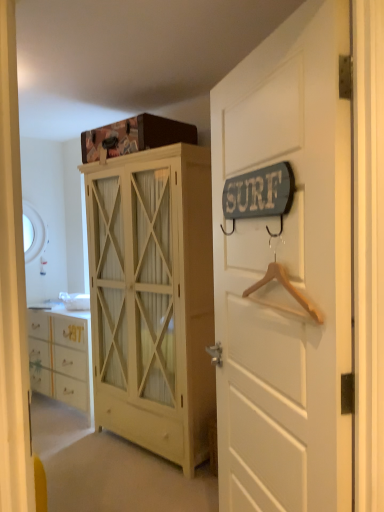
Question: Considering the relative sizes of wooden hanger at right and white wood door at upper right in the image provided, is wooden hanger at right taller than white wood door at upper right?

Choices:
 (A) yes
 (B) no

Answer: (B)

Question: Does wooden hanger at right have a lesser width compared to white wood door at upper right?

Choices:
 (A) yes
 (B) no

Answer: (A)

Question: From a real-world perspective, is wooden hanger at right beneath white wood door at upper right?

Choices:
 (A) no
 (B) yes

Answer: (A)

Question: Are wooden hanger at right and white wood door at upper right located far from each other?

Choices:
 (A) yes
 (B) no

Answer: (B)

Question: Is wooden hanger at right aimed at white wood door at upper right?

Choices:
 (A) yes
 (B) no

Answer: (A)

Question: Is wooden hanger at right at the left side of white wood door at upper right?

Choices:
 (A) no
 (B) yes

Answer: (A)

Question: Can you confirm if matte yellow cabinet at center is bigger than white wood door at upper right?

Choices:
 (A) no
 (B) yes

Answer: (B)

Question: Is white wood door at upper right a part of matte yellow cabinet at center?

Choices:
 (A) no
 (B) yes

Answer: (A)

Question: From a real-world perspective, is matte yellow cabinet at center beneath white wood door at upper right?

Choices:
 (A) yes
 (B) no

Answer: (A)

Question: Considering the relative positions of matte yellow cabinet at center and white wood door at upper right in the image provided, is matte yellow cabinet at center to the right of white wood door at upper right from the viewer's perspective?

Choices:
 (A) yes
 (B) no

Answer: (B)

Question: From a real-world perspective, is matte yellow cabinet at center located higher than white wood door at upper right?

Choices:
 (A) yes
 (B) no

Answer: (B)

Question: Does matte yellow cabinet at center have a lesser height compared to white wood door at upper right?

Choices:
 (A) no
 (B) yes

Answer: (A)

Question: Is matte yellow cabinet at center to the left of wooden hanger at right from the viewer's perspective?

Choices:
 (A) yes
 (B) no

Answer: (A)